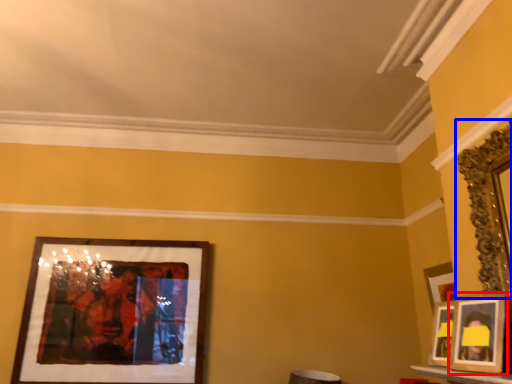
Question: Which point is further to the camera, picture frame (highlighted by a red box) or picture frame (highlighted by a blue box)?

Choices:
 (A) picture frame
 (B) picture frame

Answer: (A)